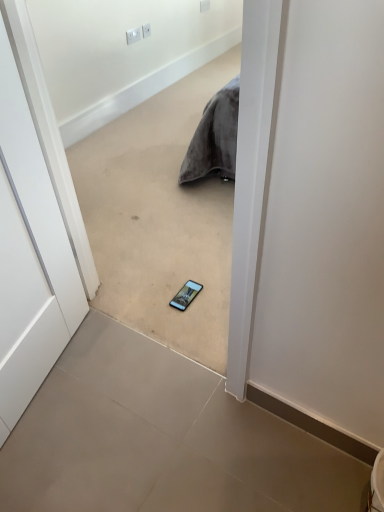
Image resolution: width=384 pixels, height=512 pixels. What do you see at coordinates (146, 30) in the screenshot?
I see `white plastic electric outlet at upper center, marked as the 2th electric outlet in a front-to-back arrangement` at bounding box center [146, 30].

The height and width of the screenshot is (512, 384). What are the coordinates of `white plastic electric outlet at upper center, which is counted as the 3th electric outlet, starting from the front` in the screenshot? It's located at (204, 5).

Between matte black smartphone at center and gray tile floor at center, which ranks as the 2th concrete in top-to-bottom order, which one has larger width?

With larger width is gray tile floor at center, which ranks as the 2th concrete in top-to-bottom order.

Is matte black smartphone at center at the left side of gray tile floor at center, which ranks as the 2th concrete in top-to-bottom order?

No, matte black smartphone at center is not to the left of gray tile floor at center, which ranks as the 2th concrete in top-to-bottom order.

Is matte black smartphone at center spatially inside gray tile floor at center, positioned as the first concrete in bottom-to-top order, or outside of it?

matte black smartphone at center is located beyond the bounds of gray tile floor at center, positioned as the first concrete in bottom-to-top order.

Can you tell me how much matte black smartphone at center and gray tile floor at center, positioned as the first concrete in bottom-to-top order, differ in facing direction?

The angular difference between matte black smartphone at center and gray tile floor at center, positioned as the first concrete in bottom-to-top order, is 1.9 degrees.

Is white plastic electric outlet at upper center, which is the second electric outlet from bottom to top, far away from gray tile floor at center, which ranks as the 2th concrete in top-to-bottom order?

Indeed, white plastic electric outlet at upper center, which is the second electric outlet from bottom to top, is not near gray tile floor at center, which ranks as the 2th concrete in top-to-bottom order.

Considering the sizes of white plastic electric outlet at upper center, which is counted as the 2th electric outlet, starting from the top, and gray tile floor at center, which ranks as the 2th concrete in top-to-bottom order, in the image, is white plastic electric outlet at upper center, which is counted as the 2th electric outlet, starting from the top, wider or thinner than gray tile floor at center, which ranks as the 2th concrete in top-to-bottom order,?

In the image, white plastic electric outlet at upper center, which is counted as the 2th electric outlet, starting from the top, appears to be more narrow than gray tile floor at center, which ranks as the 2th concrete in top-to-bottom order.

In the scene shown: Do you think white plastic electric outlet at upper center, which is counted as the 2th electric outlet, starting from the top, is within gray tile floor at center, which ranks as the 2th concrete in top-to-bottom order, or outside of it?

white plastic electric outlet at upper center, which is counted as the 2th electric outlet, starting from the top, is spatially situated outside gray tile floor at center, which ranks as the 2th concrete in top-to-bottom order.

Is point (142, 30) closer or farther from the camera than point (330, 455)?

Clearly, point (142, 30) is more distant from the camera than point (330, 455).

In terms of height, does white plastic electric outlet at upper center, acting as the third electric outlet starting from the back, look taller or shorter compared to gray tile floor at center, which ranks as the 2th concrete in top-to-bottom order?

Considering their sizes, white plastic electric outlet at upper center, acting as the third electric outlet starting from the back, has more height than gray tile floor at center, which ranks as the 2th concrete in top-to-bottom order.

Which is behind, point (130, 38) or point (124, 354)?

The point (130, 38) is more distant.

Is white plastic electric outlet at upper center, the 1th electric outlet in the bottom-to-top sequence, not inside gray tile floor at center, which ranks as the 2th concrete in top-to-bottom order?

Yes.

Is matte black smartphone at center oriented towards white plastic electric outlet at upper center, which is the third electric outlet in bottom-to-top order?

No, matte black smartphone at center is not aimed at white plastic electric outlet at upper center, which is the third electric outlet in bottom-to-top order.

Which object is positioned more to the right, matte black smartphone at center or white plastic electric outlet at upper center, which is counted as the 3th electric outlet, starting from the front?

Positioned to the right is white plastic electric outlet at upper center, which is counted as the 3th electric outlet, starting from the front.

From a real-world perspective, is matte black smartphone at center on top of white plastic electric outlet at upper center, the 1th electric outlet positioned from the back?

Actually, matte black smartphone at center is physically below white plastic electric outlet at upper center, the 1th electric outlet positioned from the back, in the real world.

Considering the sizes of objects matte black smartphone at center and white plastic electric outlet at upper center, the 3th electric outlet from the left, in the image provided, who is wider, matte black smartphone at center or white plastic electric outlet at upper center, the 3th electric outlet from the left,?

matte black smartphone at center.

Considering the sizes of white plastic electric outlet at upper center, which is the third electric outlet in bottom-to-top order, and white matte door at center in the image, is white plastic electric outlet at upper center, which is the third electric outlet in bottom-to-top order, bigger or smaller than white matte door at center?

white plastic electric outlet at upper center, which is the third electric outlet in bottom-to-top order, is smaller than white matte door at center.

From a real-world perspective, is white plastic electric outlet at upper center, the 3th electric outlet from the left, beneath white matte door at center?

Correct, in the physical world, white plastic electric outlet at upper center, the 3th electric outlet from the left, is lower than white matte door at center.

Starting from the white matte door at center, which electric outlet is the 3rd one to the right? Please provide its 2D coordinates.

[(204, 5)]

Considering the positions of objects matte black smartphone at center and gray tile floor at center, which is the 1th concrete in top-to-bottom order, in the image provided, who is in front, matte black smartphone at center or gray tile floor at center, which is the 1th concrete in top-to-bottom order,?

gray tile floor at center, which is the 1th concrete in top-to-bottom order, is in front.

From the image's perspective, which object appears higher, matte black smartphone at center or gray tile floor at center, which is the 1th concrete in top-to-bottom order?

gray tile floor at center, which is the 1th concrete in top-to-bottom order, appears higher in the image.

Which of these two, matte black smartphone at center or gray tile floor at center, placed as the second concrete when sorted from bottom to top, is thinner?

With smaller width is matte black smartphone at center.

Would you say matte black smartphone at center is outside gray tile floor at center, which is the 1th concrete in top-to-bottom order?

matte black smartphone at center lies outside gray tile floor at center, which is the 1th concrete in top-to-bottom order,'s area.

From the image's perspective, which is below, gray tile floor at center, positioned as the first concrete in bottom-to-top order, or white matte door at center?

gray tile floor at center, positioned as the first concrete in bottom-to-top order.

Is point (148, 377) closer to viewer compared to point (36, 290)?

That is False.

Is gray tile floor at center, which ranks as the 2th concrete in top-to-bottom order, next to white matte door at center?

gray tile floor at center, which ranks as the 2th concrete in top-to-bottom order, and white matte door at center are clearly separated.

Between gray tile floor at center, positioned as the first concrete in bottom-to-top order, and white matte door at center, which one has smaller width?

white matte door at center.

Where is `smartphone behind the gray tile floor at center, positioned as the first concrete in bottom-to-top order`? The height and width of the screenshot is (512, 384). smartphone behind the gray tile floor at center, positioned as the first concrete in bottom-to-top order is located at coordinates (186, 295).

What are the coordinates of `concrete beneath the white plastic electric outlet at upper center, marked as the 2th electric outlet in a front-to-back arrangement (from a real-world perspective)` in the screenshot? It's located at (161, 439).

Looking at the image, which one is located closer to white plastic electric outlet at upper center, which ranks as the first electric outlet in top-to-bottom order, gray tile floor at center, which ranks as the 2th concrete in top-to-bottom order, or white plastic electric outlet at upper center, acting as the 1th electric outlet starting from the front?

The object closer to white plastic electric outlet at upper center, which ranks as the first electric outlet in top-to-bottom order, is white plastic electric outlet at upper center, acting as the 1th electric outlet starting from the front.

Looking at the image, which one is located closer to white plastic electric outlet at upper center, the 3th electric outlet from the left, gray tile floor at center, placed as the second concrete when sorted from bottom to top, or matte black smartphone at center?

gray tile floor at center, placed as the second concrete when sorted from bottom to top, is closer to white plastic electric outlet at upper center, the 3th electric outlet from the left.

Considering their positions, is white plastic electric outlet at upper center, the 1th electric outlet when ordered from left to right, positioned closer to gray tile floor at center, which is the 1th concrete in top-to-bottom order, than white plastic electric outlet at upper center, which is counted as the 3th electric outlet, starting from the front?

white plastic electric outlet at upper center, the 1th electric outlet when ordered from left to right, lies closer to gray tile floor at center, which is the 1th concrete in top-to-bottom order, than the other object.

Consider the image. From the image, which object appears to be nearer to white matte door at center, white plastic electric outlet at upper center, which is the first electric outlet in right-to-left order, or white plastic electric outlet at upper center, positioned as the 3th electric outlet in top-to-bottom order?

Based on the image, white plastic electric outlet at upper center, positioned as the 3th electric outlet in top-to-bottom order, appears to be nearer to white matte door at center.

Estimate the real-world distances between objects in this image. Which object is closer to matte black smartphone at center, white matte door at center or gray tile floor at center, which is the 1th concrete in top-to-bottom order?

white matte door at center lies closer to matte black smartphone at center than the other object.

Which object lies nearer to the anchor point white matte door at center, gray tile floor at center, which is the 1th concrete in top-to-bottom order, or white plastic electric outlet at upper center, the 1th electric outlet when ordered from left to right?

gray tile floor at center, which is the 1th concrete in top-to-bottom order.

Considering their positions, is gray tile floor at center, placed as the second concrete when sorted from bottom to top, positioned closer to gray tile floor at center, which ranks as the 2th concrete in top-to-bottom order, than white plastic electric outlet at upper center, which is counted as the 3th electric outlet, starting from the front?

Among the two, gray tile floor at center, placed as the second concrete when sorted from bottom to top, is located nearer to gray tile floor at center, which ranks as the 2th concrete in top-to-bottom order.

Considering their positions, is white plastic electric outlet at upper center, which is the second electric outlet from bottom to top, positioned further to white plastic electric outlet at upper center, which is the third electric outlet in bottom-to-top order, than white matte door at center?

white matte door at center is positioned further to the anchor white plastic electric outlet at upper center, which is the third electric outlet in bottom-to-top order.

This screenshot has width=384, height=512. In order to click on smartphone positioned between gray tile floor at center, which is the 1th concrete in top-to-bottom order, and white plastic electric outlet at upper center, positioned as the 3th electric outlet in top-to-bottom order, from near to far in this screenshot , I will do `click(186, 295)`.

You are a GUI agent. You are given a task and a screenshot of the screen. Output one action in this format:
    pyautogui.click(x=<x>, y=<y>)
    Task: Click on the door between gray tile floor at center, placed as the second concrete when sorted from bottom to top, and gray tile floor at center, positioned as the first concrete in bottom-to-top order, from top to bottom
    The image size is (384, 512).
    Given the screenshot: What is the action you would take?
    pyautogui.click(x=29, y=256)

The height and width of the screenshot is (512, 384). In order to click on smartphone positioned between gray tile floor at center, which is the 1th concrete in top-to-bottom order, and white plastic electric outlet at upper center, the 1th electric outlet positioned from the back, from near to far in this screenshot , I will do `click(186, 295)`.

This screenshot has width=384, height=512. I want to click on electric outlet between white plastic electric outlet at upper center, acting as the 1th electric outlet starting from the front, and white plastic electric outlet at upper center, the 3th electric outlet from the left, in the front-back direction, so click(x=146, y=30).